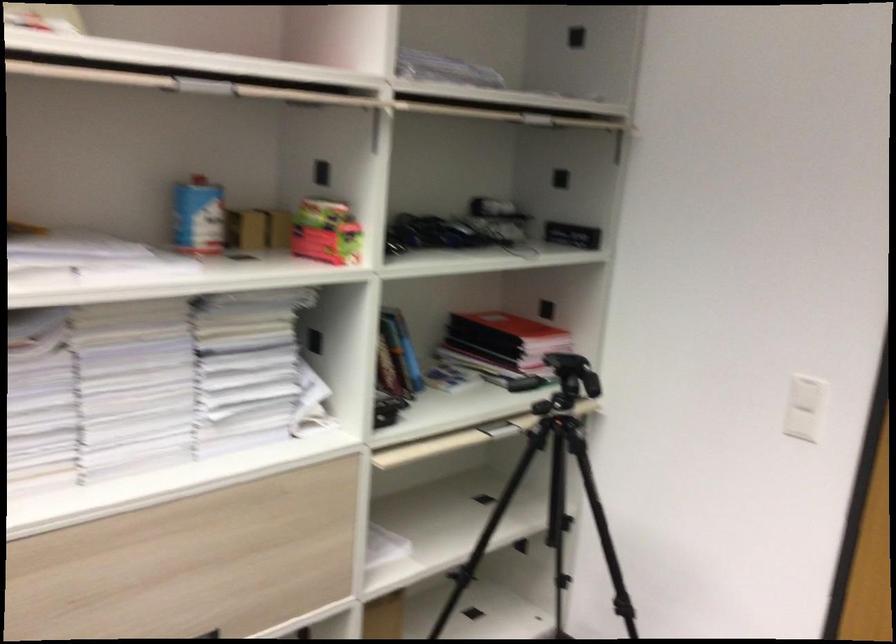
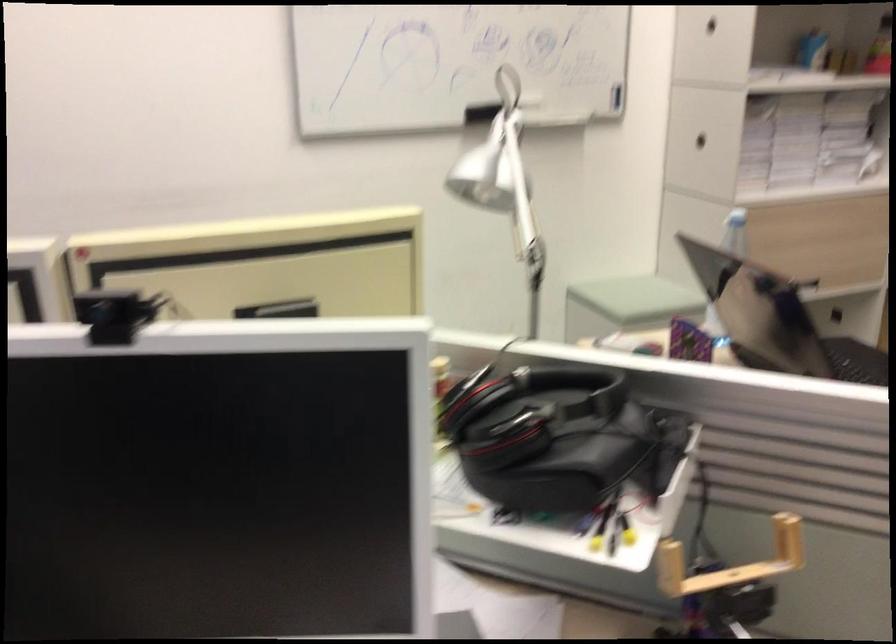
The images are taken continuously from a first-person perspective. In which direction are you moving?

The cameraman walked toward left, backward.